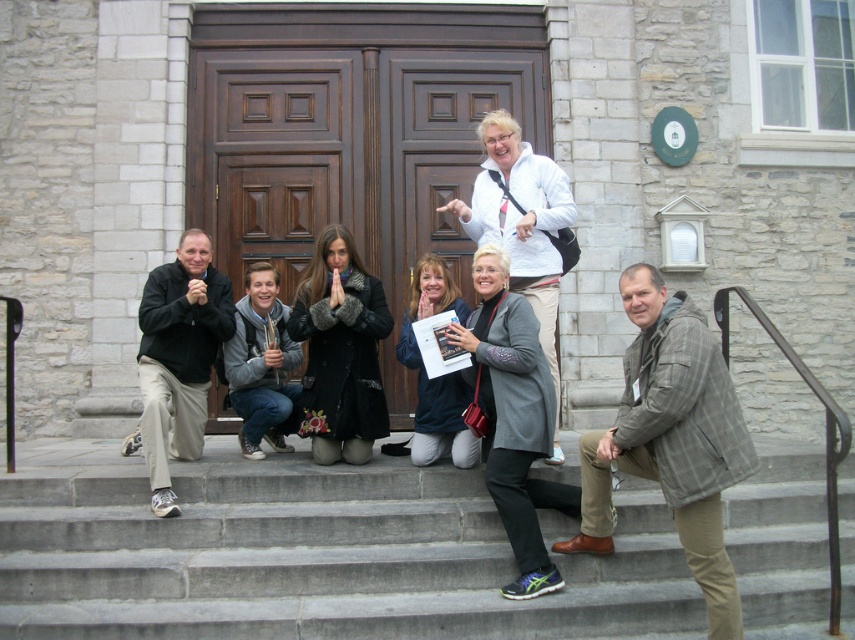
You are a photographer trying to capture a group photo. You notice the gray concrete stairs at center and the black matte pants at lower left in the scene. Which object is shorter in height?

The gray concrete stairs at center is not as tall as the black matte pants at lower left, so the stairs are shorter in height.

You are a photographer trying to capture a group photo. You notice the gray plaid jacket at center and the black matte pants at lower left. Which object should you adjust to ensure both are centered in the frame?

The gray plaid jacket at center is to the right of black matte pants at lower left. To center both in the frame, adjust the black matte pants at lower left to move it towards the right so it aligns with the gray plaid jacket at center.

You are a photographer trying to adjust the composition of the group photo. You want to ensure that the gray plaid jacket at center and the black matte pants at lower left are visible in the frame. Based on their positions, which object is closer to the bottom edge of the photo?

The gray plaid jacket at center is below the black matte pants at lower left, so the gray plaid jacket at center is closer to the bottom edge of the photo.